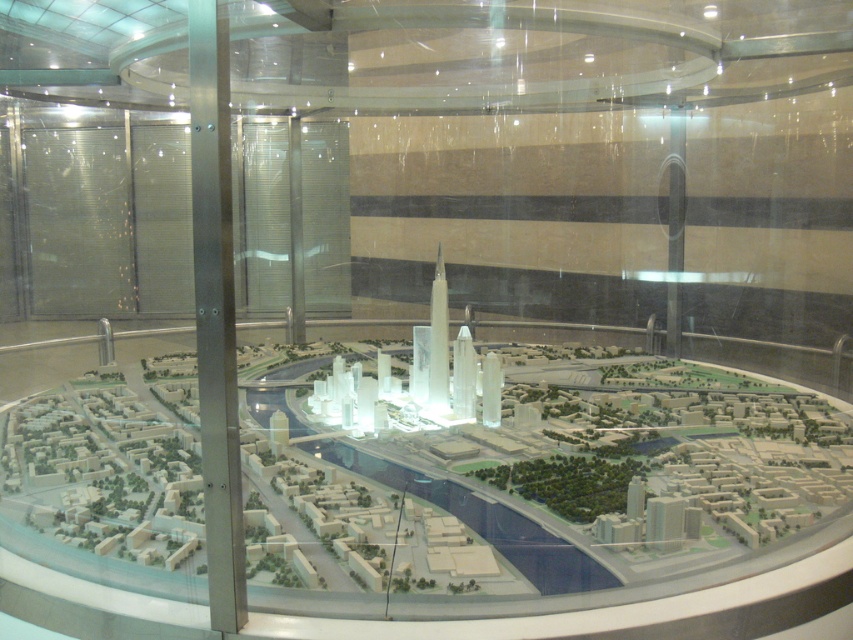
Question: Is transparent plastic city model at center below silver metallic pillar at center?

Choices:
 (A) no
 (B) yes

Answer: (A)

Question: Is transparent plastic city model at center bigger than silver metallic pillar at center?

Choices:
 (A) no
 (B) yes

Answer: (B)

Question: Which of the following is the closest to the observer?

Choices:
 (A) transparent plastic city model at center
 (B) silver metallic pillar at center

Answer: (B)

Question: Which point is farther to the camera?

Choices:
 (A) silver metallic pillar at center
 (B) transparent plastic city model at center

Answer: (B)

Question: Which object is closer to the camera taking this photo?

Choices:
 (A) silver metallic pillar at center
 (B) transparent plastic city model at center

Answer: (A)

Question: Is transparent plastic city model at center thinner than silver metallic pillar at center?

Choices:
 (A) yes
 (B) no

Answer: (B)